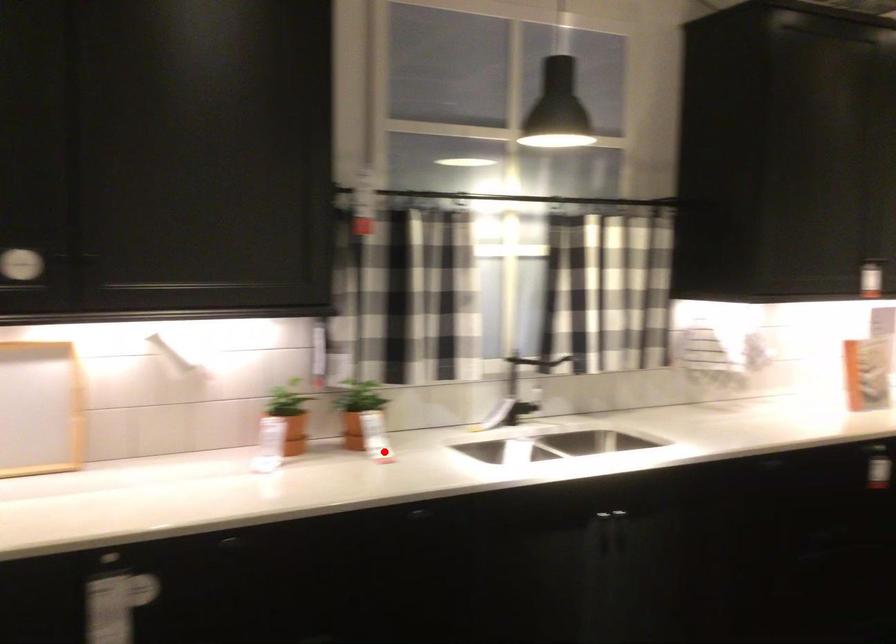
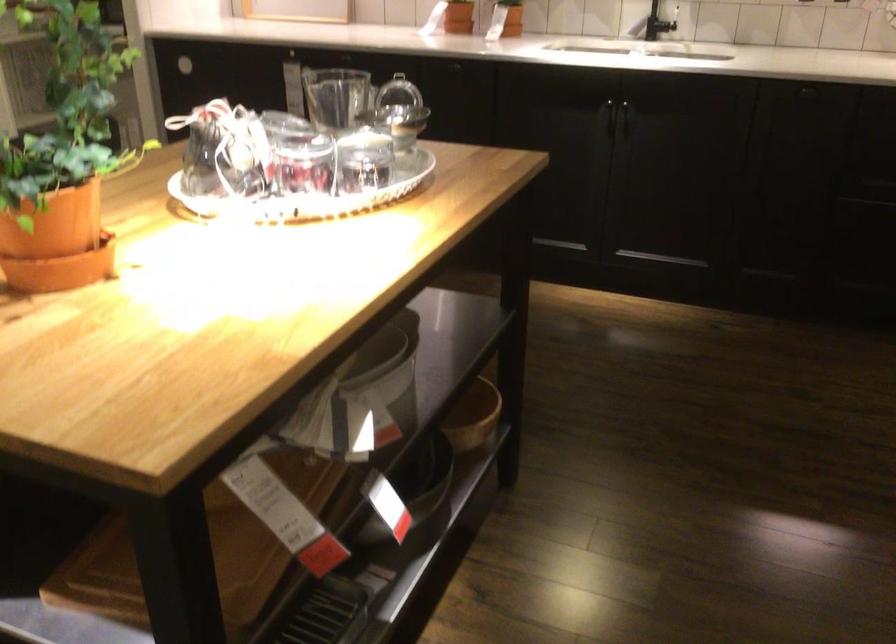
Find the pixel in the second image that matches the highlighted location in the first image.

(504, 31)